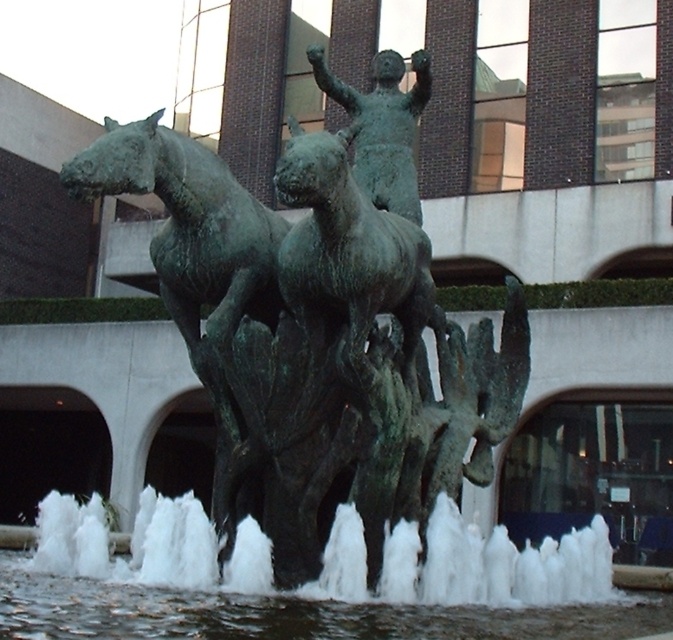
You are standing in the plaza and see the sculpture. The point at coordinates (x=197, y=262) is part of which object in the sculpture?

The point at coordinates (x=197, y=262) is part of the green patina horse at left.

You are standing in a plaza and want to take a photo of the bronze sculpture. The point at coordinates point (x=507, y=355) is part of the sculpture. If you are 29.20 meters away from this point, is the sculpture too far to capture clearly in your photo?

The point (x=507, y=355) on the sculpture is 29.20 meters away from you. Whether the sculpture is too far depends on your camera equipment. Most modern cameras can capture clear images at this distance with proper zoom, but if you need a detailed closeup, you might need a telephoto lens.